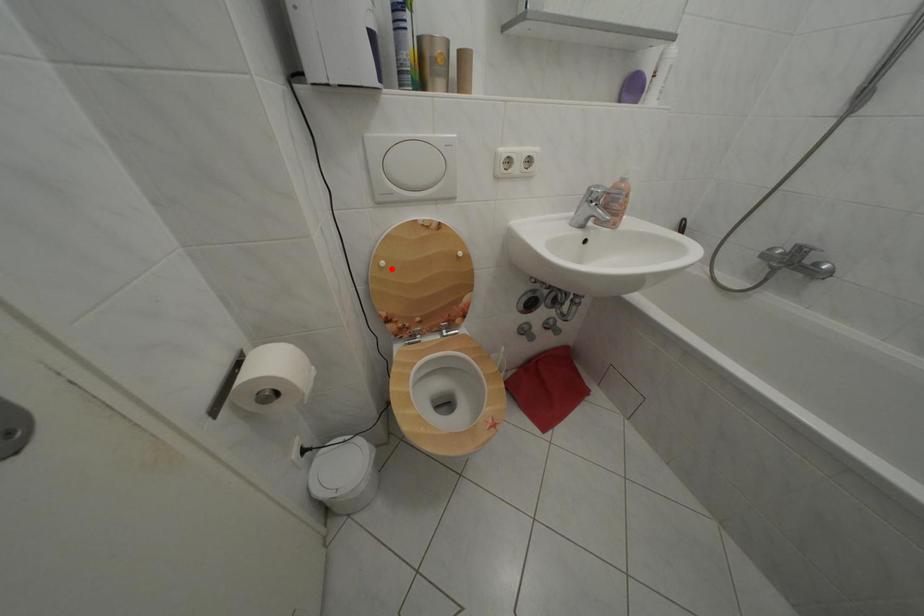
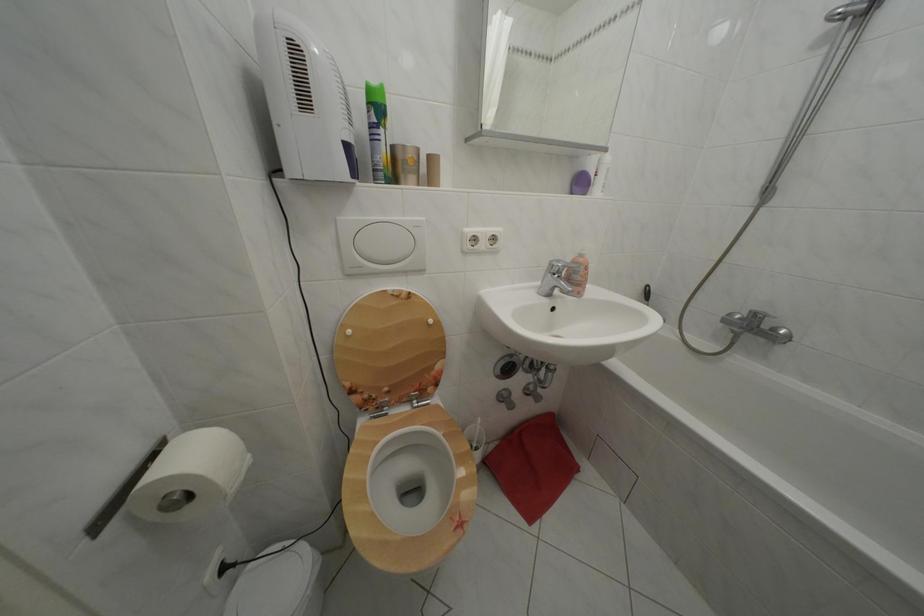
Question: I am providing you with two images of the same scene from different viewpoints. A red point is marked on the first image. Is the red point's position out of view in image 2?

Choices:
 (A) Yes
 (B) No

Answer: (B)